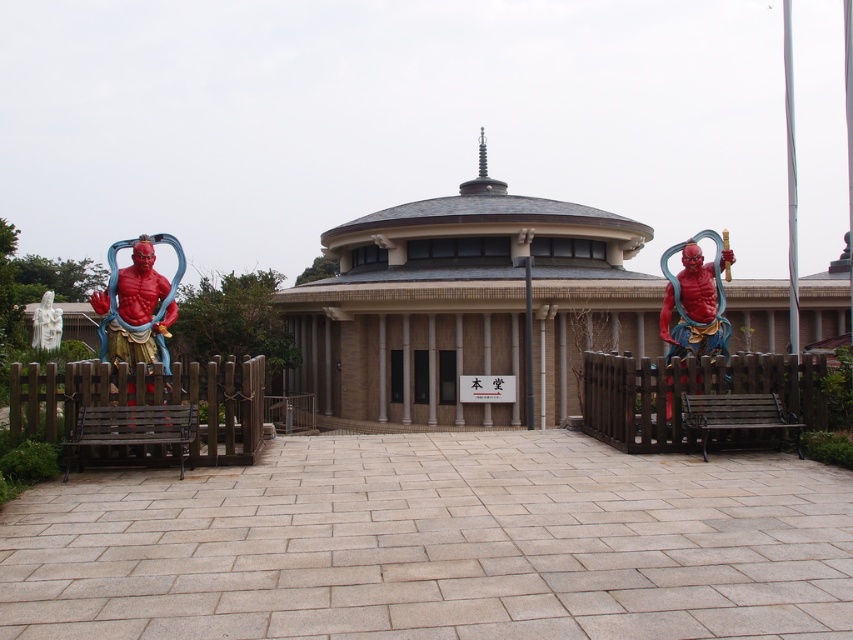
Based on the photo, is matte red statue at right to the right of smooth wood pole at center from the viewer's perspective?

Yes, matte red statue at right is to the right of smooth wood pole at center.

Can you confirm if matte red statue at right is smaller than smooth wood pole at center?

Yes.

Where is `matte red statue at right`? matte red statue at right is located at coordinates (695, 300).

This screenshot has height=640, width=853. Identify the location of matte red statue at right. (695, 300).

Does point (527, 371) lie in front of point (41, 324)?

Yes, point (527, 371) is closer to viewer.

Is smooth wood pole at center in front of white marble statue at lower left?

Yes, smooth wood pole at center is closer to the viewer.

The height and width of the screenshot is (640, 853). Describe the element at coordinates (527, 339) in the screenshot. I see `smooth wood pole at center` at that location.

Identify the location of smooth wood pole at center. This screenshot has width=853, height=640. (527, 339).

How far apart are matte red statue at right and white marble statue at lower left?

matte red statue at right and white marble statue at lower left are 17.43 meters apart from each other.

Is matte red statue at right taller than white marble statue at lower left?

Yes.

Between point (677, 289) and point (51, 298), which one is positioned behind?

The point (51, 298) is more distant.

At what (x,y) coordinates should I click in order to perform the action: click on matte red statue at right. Please return your answer as a coordinate pair (x, y). This screenshot has height=640, width=853. Looking at the image, I should click on (695, 300).